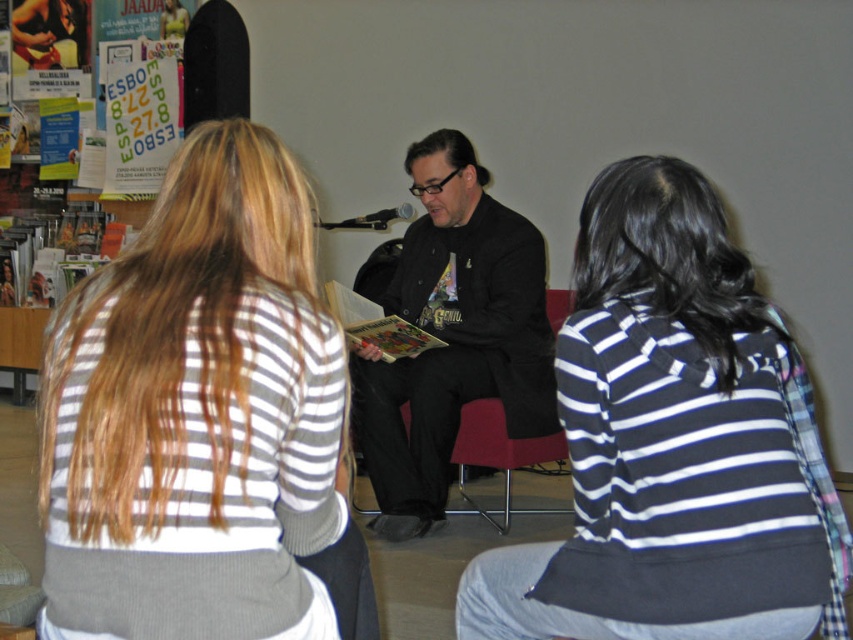
You are organizing a photoshoot and need to ensure that the striped sweater at center and the matte black jacket at center are both visible in the frame. Based on their sizes, which one is more likely to be fully visible without cropping?

The striped sweater at center is smaller in size compared to the matte black jacket at center, so it is more likely to be fully visible without cropping.

You are a tailor measuring clothing for a customer. The customer wants to know if the black and white striped sweater at center can fit inside the matte black jacket at center. Based on the provided scene, can you determine if the sweater is narrower than the jacket?

The black and white striped sweater at center is narrower than the matte black jacket at center, so it can fit inside.